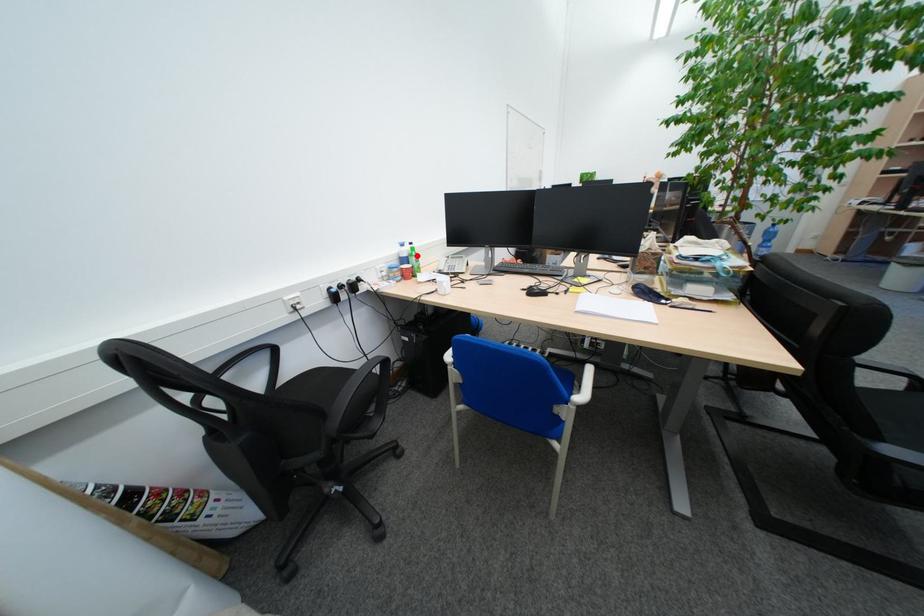
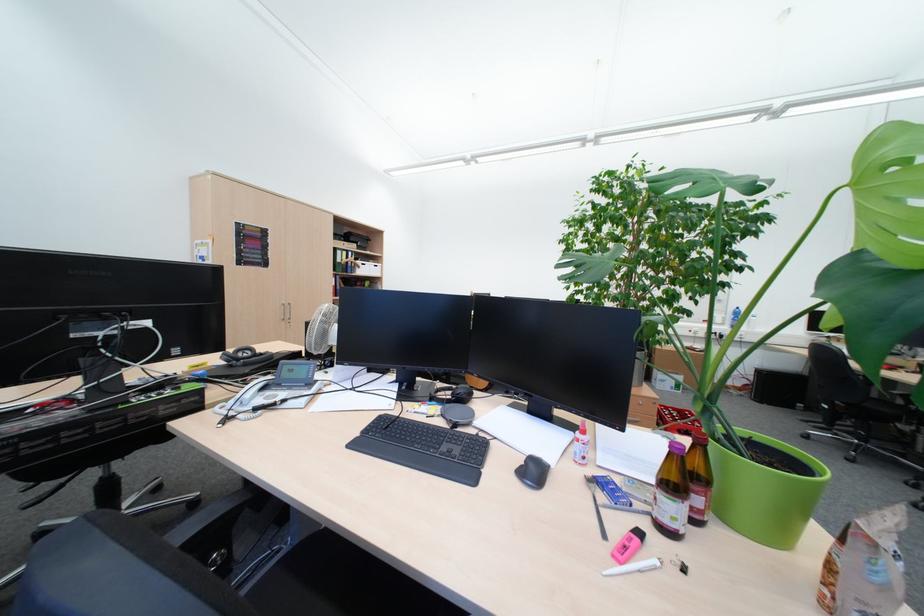
Question: I am providing you with two images of the same scene from different viewpoints. A red point is marked on the first image. Is the red point's position out of view in image 2?

Choices:
 (A) Yes
 (B) No

Answer: (A)